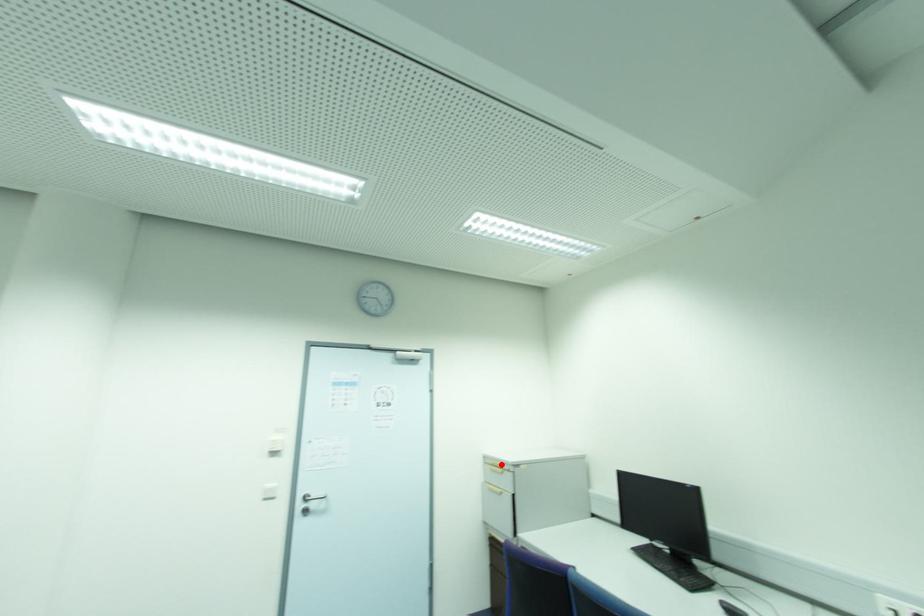
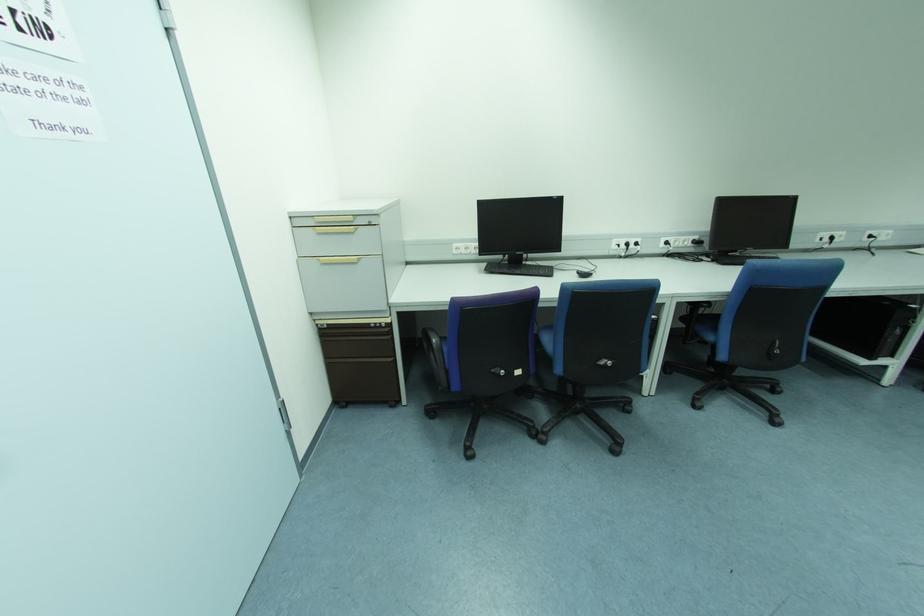
Question: I am providing you with two images of the same scene from different viewpoints. A red point is marked on the first image. Can you still see the location of the red point in image 2?

Choices:
 (A) Yes
 (B) No

Answer: (A)